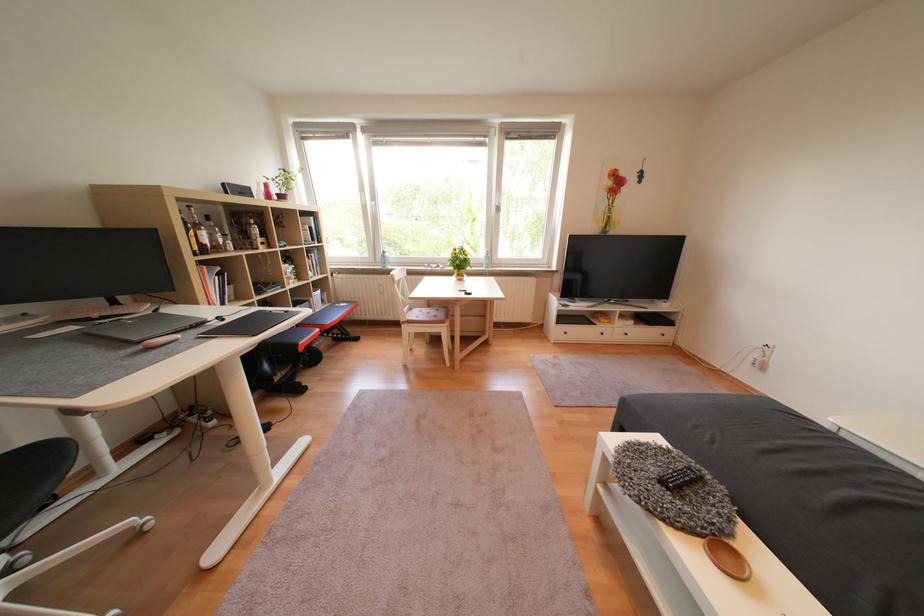
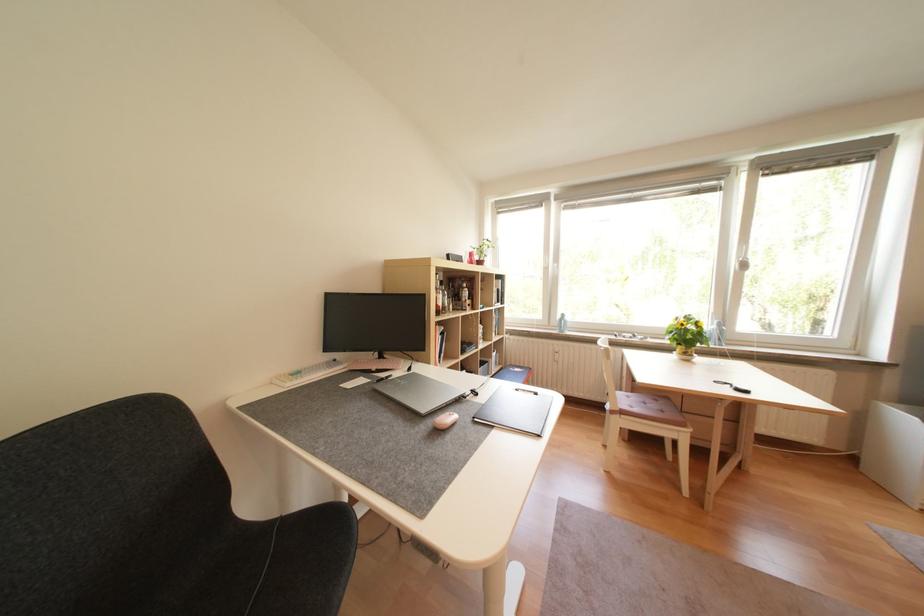
Question: The first image is from the beginning of the video and the second image is from the end. How did the camera likely rotate when shooting the video?

Choices:
 (A) Left
 (B) Right
 (C) Up
 (D) Down

Answer: (A)